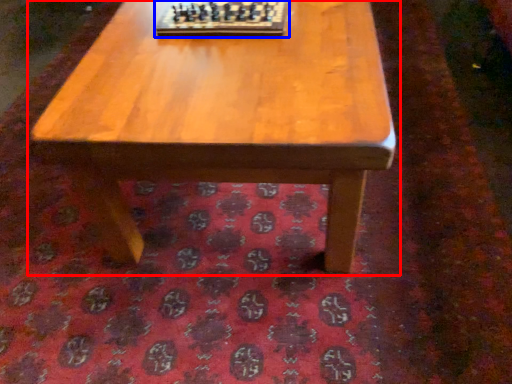
Question: Which of the following is the closest to the observer, coffee table (highlighted by a red box) or board game (highlighted by a blue box)?

Choices:
 (A) coffee table
 (B) board game

Answer: (A)